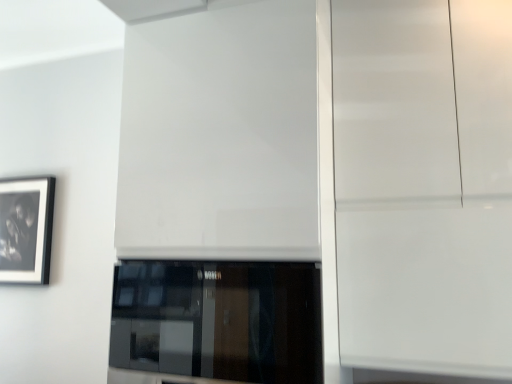
Image resolution: width=512 pixels, height=384 pixels. I want to click on black glass window at center, so click(216, 322).

At what (x,y) coordinates should I click in order to perform the action: click on white glossy door at center. Please return your answer as a coordinate pair (x, y). This screenshot has width=512, height=384. Looking at the image, I should click on (220, 135).

The height and width of the screenshot is (384, 512). I want to click on black glass window at center, so click(216, 322).

Is black matte picture frame at left a part of glossy white cabinet at right?

No, black matte picture frame at left is not inside glossy white cabinet at right.

Can you confirm if glossy white cabinet at right is thinner than black matte picture frame at left?

In fact, glossy white cabinet at right might be wider than black matte picture frame at left.

From a real-world perspective, who is located higher, glossy white cabinet at right or black matte picture frame at left?

glossy white cabinet at right is physically above.

From the picture: How much distance is there between glossy white cabinet at right and black matte picture frame at left?

They are 5.40 feet apart.

Which is more to the right, black matte picture frame at left or white glossy door at center?

white glossy door at center.

From the image's perspective, who appears lower, black matte picture frame at left or white glossy door at center?

black matte picture frame at left.

Which point is more distant from viewer, [33,194] or [286,43]?

The point [33,194] is more distant.

From the picture: Can you tell me how much black matte picture frame at left and white glossy door at center differ in facing direction?

0.586 degrees separate the facing orientations of black matte picture frame at left and white glossy door at center.

In the scene shown: Is glossy white cabinet at right in front of white glossy door at center?

No, glossy white cabinet at right is further to the viewer.

Does glossy white cabinet at right have a lesser height compared to white glossy door at center?

Yes.

Is glossy white cabinet at right oriented away from white glossy door at center?

glossy white cabinet at right does not have its back to white glossy door at center.

Which is closer, (496,268) or (194,87)?

Point (496,268) appears to be closer to the viewer than point (194,87).

Is black glass window at center positioned behind black matte picture frame at left?

No, the depth of black glass window at center is less than that of black matte picture frame at left.

Is black glass window at center not inside black matte picture frame at left?

Indeed, black glass window at center is completely outside black matte picture frame at left.

Is black glass window at center oriented away from black matte picture frame at left?

No.

The image size is (512, 384). In the image, there is a black matte picture frame at left. Identify the location of window below it (from the image's perspective). [x=216, y=322].

Would you say black glass window at center is outside white glossy door at center?

Actually, black glass window at center is at least partially inside white glossy door at center.

Is black glass window at center behind white glossy door at center?

No.

Is point (314, 374) farther from viewer compared to point (187, 237)?

That is False.

How far apart are black glass window at center and white glossy door at center?

black glass window at center and white glossy door at center are 10.62 inches apart from each other.

Could you tell me if black matte picture frame at left is turned towards glossy white cabinet at right?

No, black matte picture frame at left is not aimed at glossy white cabinet at right.

Considering the sizes of objects black matte picture frame at left and glossy white cabinet at right in the image provided, who is bigger, black matte picture frame at left or glossy white cabinet at right?

Bigger between the two is glossy white cabinet at right.

Which of these two, black matte picture frame at left or glossy white cabinet at right, stands shorter?

With less height is black matte picture frame at left.

Which is more distant, (x=22, y=214) or (x=371, y=221)?

Positioned behind is point (x=22, y=214).

Could you tell me if white glossy door at center is turned towards black glass window at center?

Yes, white glossy door at center is facing black glass window at center.

Can you tell me how much white glossy door at center and black glass window at center differ in facing direction?

0.292 degrees separate the facing orientations of white glossy door at center and black glass window at center.

Is point (258, 234) positioned after point (213, 374)?

Yes, it is.

Who is smaller, white glossy door at center or black glass window at center?

black glass window at center is smaller.

Where is `glass door in front of the black matte picture frame at left`? The width and height of the screenshot is (512, 384). glass door in front of the black matte picture frame at left is located at coordinates (424, 184).

I want to click on picture frame on the left of white glossy door at center, so click(x=26, y=229).

From the image, which object appears to be farther from white glossy door at center, glossy white cabinet at right or black glass window at center?

glossy white cabinet at right.

When comparing their distances from white glossy door at center, does black glass window at center or glossy white cabinet at right seem further?

The object further to white glossy door at center is glossy white cabinet at right.

Based on their spatial positions, is glossy white cabinet at right or black matte picture frame at left closer to black glass window at center?

glossy white cabinet at right lies closer to black glass window at center than the other object.

Which object lies nearer to the anchor point black glass window at center, black matte picture frame at left or glossy white cabinet at right?

The object closer to black glass window at center is glossy white cabinet at right.

Looking at the image, which one is located closer to glossy white cabinet at right, black glass window at center or white glossy door at center?

white glossy door at center is positioned closer to the anchor glossy white cabinet at right.

Considering their positions, is black matte picture frame at left positioned closer to glossy white cabinet at right than black glass window at center?

The object closer to glossy white cabinet at right is black glass window at center.

Which object lies further to the anchor point black glass window at center, black matte picture frame at left or white glossy door at center?

black matte picture frame at left lies further to black glass window at center than the other object.

Which object lies further to the anchor point black glass window at center, glossy white cabinet at right or white glossy door at center?

Among the two, glossy white cabinet at right is located further to black glass window at center.

Identify the location of window between white glossy door at center and glossy white cabinet at right in the horizontal direction. The width and height of the screenshot is (512, 384). (216, 322).

This screenshot has height=384, width=512. I want to click on door between black matte picture frame at left and glossy white cabinet at right in the horizontal direction, so click(220, 135).

Image resolution: width=512 pixels, height=384 pixels. Identify the location of door between black matte picture frame at left and black glass window at center. (220, 135).

Where is `window located between black matte picture frame at left and glossy white cabinet at right in the left-right direction`? window located between black matte picture frame at left and glossy white cabinet at right in the left-right direction is located at coordinates (216, 322).